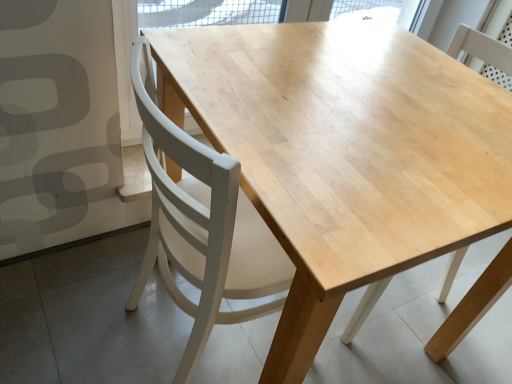
Question: Is light wood chair at center, which ranks as the 2th chair in left-to-right order, aimed at white wood chair at center, arranged as the first chair when viewed from the left?

Choices:
 (A) no
 (B) yes

Answer: (B)

Question: Considering the relative sizes of light wood chair at center, which ranks as the 2th chair in left-to-right order, and white wood chair at center, positioned as the 2th chair in right-to-left order, in the image provided, is light wood chair at center, which ranks as the 2th chair in left-to-right order, bigger than white wood chair at center, positioned as the 2th chair in right-to-left order,?

Choices:
 (A) no
 (B) yes

Answer: (A)

Question: Can you confirm if light wood chair at center, which ranks as the 2th chair in left-to-right order, is positioned to the right of white wood chair at center, arranged as the first chair when viewed from the left?

Choices:
 (A) no
 (B) yes

Answer: (B)

Question: Does light wood chair at center, which ranks as the 2th chair in left-to-right order, appear on the left side of white wood chair at center, positioned as the 2th chair in right-to-left order?

Choices:
 (A) yes
 (B) no

Answer: (B)

Question: From the image's perspective, is light wood chair at center, marked as the 1th chair in a right-to-left arrangement, on top of white wood chair at center, positioned as the 2th chair in right-to-left order?

Choices:
 (A) yes
 (B) no

Answer: (A)

Question: From a real-world perspective, is light wood chair at center, which ranks as the 2th chair in left-to-right order, located higher than white wood chair at center, positioned as the 2th chair in right-to-left order?

Choices:
 (A) yes
 (B) no

Answer: (B)

Question: Considering the relative positions of white wood chair at center, positioned as the 2th chair in right-to-left order, and light wood chair at center, marked as the 1th chair in a right-to-left arrangement, in the image provided, is white wood chair at center, positioned as the 2th chair in right-to-left order, in front of light wood chair at center, marked as the 1th chair in a right-to-left arrangement,?

Choices:
 (A) yes
 (B) no

Answer: (A)

Question: Would you say light wood chair at center, which ranks as the 2th chair in left-to-right order, is part of white wood chair at center, arranged as the first chair when viewed from the left,'s contents?

Choices:
 (A) no
 (B) yes

Answer: (A)

Question: Considering the relative sizes of white wood chair at center, arranged as the first chair when viewed from the left, and light wood chair at center, which ranks as the 2th chair in left-to-right order, in the image provided, is white wood chair at center, arranged as the first chair when viewed from the left, smaller than light wood chair at center, which ranks as the 2th chair in left-to-right order,?

Choices:
 (A) no
 (B) yes

Answer: (A)

Question: Could you tell me if white wood chair at center, positioned as the 2th chair in right-to-left order, is facing light wood chair at center, marked as the 1th chair in a right-to-left arrangement?

Choices:
 (A) yes
 (B) no

Answer: (A)

Question: Is white wood chair at center, arranged as the first chair when viewed from the left, to the left of light wood chair at center, which ranks as the 2th chair in left-to-right order, from the viewer's perspective?

Choices:
 (A) yes
 (B) no

Answer: (A)

Question: Considering the relative sizes of white wood chair at center, positioned as the 2th chair in right-to-left order, and light wood chair at center, which ranks as the 2th chair in left-to-right order, in the image provided, is white wood chair at center, positioned as the 2th chair in right-to-left order, thinner than light wood chair at center, which ranks as the 2th chair in left-to-right order,?

Choices:
 (A) yes
 (B) no

Answer: (B)

Question: Considering the relative positions of light wood chair at center, marked as the 1th chair in a right-to-left arrangement, and white wood chair at center, arranged as the first chair when viewed from the left, in the image provided, is light wood chair at center, marked as the 1th chair in a right-to-left arrangement, to the left or to the right of white wood chair at center, arranged as the first chair when viewed from the left,?

Choices:
 (A) right
 (B) left

Answer: (A)